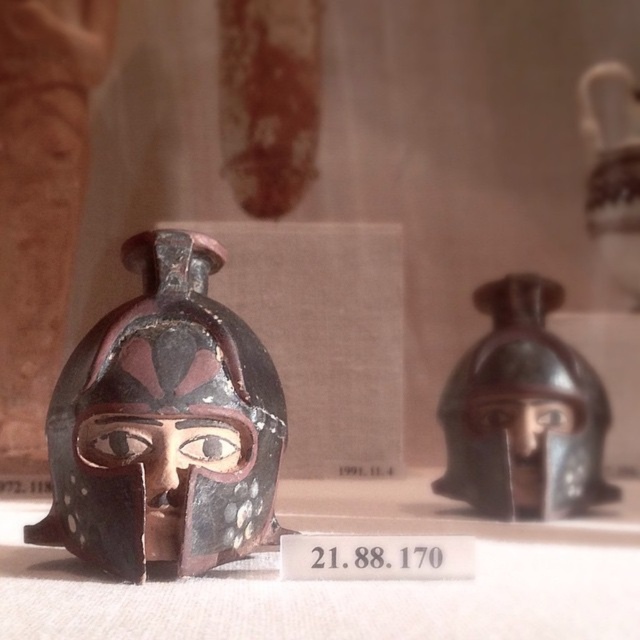
Question: Is matte black helmet at left above matte black helmet at right?

Choices:
 (A) no
 (B) yes

Answer: (B)

Question: Which point appears farthest from the camera in this image?

Choices:
 (A) (125, 472)
 (B) (586, 490)

Answer: (B)

Question: Can you confirm if matte black helmet at left is positioned to the right of matte black helmet at right?

Choices:
 (A) yes
 (B) no

Answer: (B)

Question: Which point is closer to the camera?

Choices:
 (A) (269, 440)
 (B) (525, 364)

Answer: (A)

Question: Is matte black helmet at left positioned before matte black helmet at right?

Choices:
 (A) yes
 (B) no

Answer: (A)